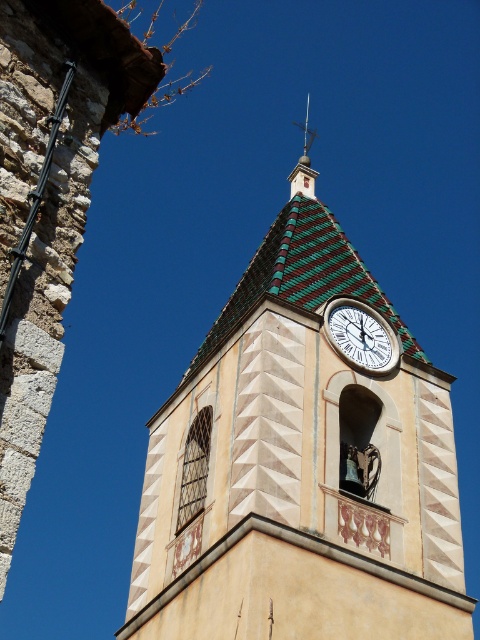
You are standing in front of the church tower and want to take a photo of the white glossy clock at upper center. However, there is a green and white tiled clock tower at center blocking your view. Is the clock tower in front of the clock or behind it?

The green and white tiled clock tower at center is to the left of the white glossy clock at upper center, so it is not blocking the view of the clock. You can take the photo without any obstruction.

You are standing at the base of the church tower and want to take a photo of the white glossy clock at upper center. The camera you have can focus up to 40 meters. Will you be able to capture a clear image of the clock?

The white glossy clock at upper center is 43.39 meters away from the camera. Since the camera can only focus up to 40 meters, you won not be able to capture a clear image of the clock.

You are an architect examining the church tower. You notice the white glossy clock at upper center and the green striped spire at upper center. Which of these two objects appears larger in the image?

The green striped spire at upper center appears larger than the white glossy clock at upper center.